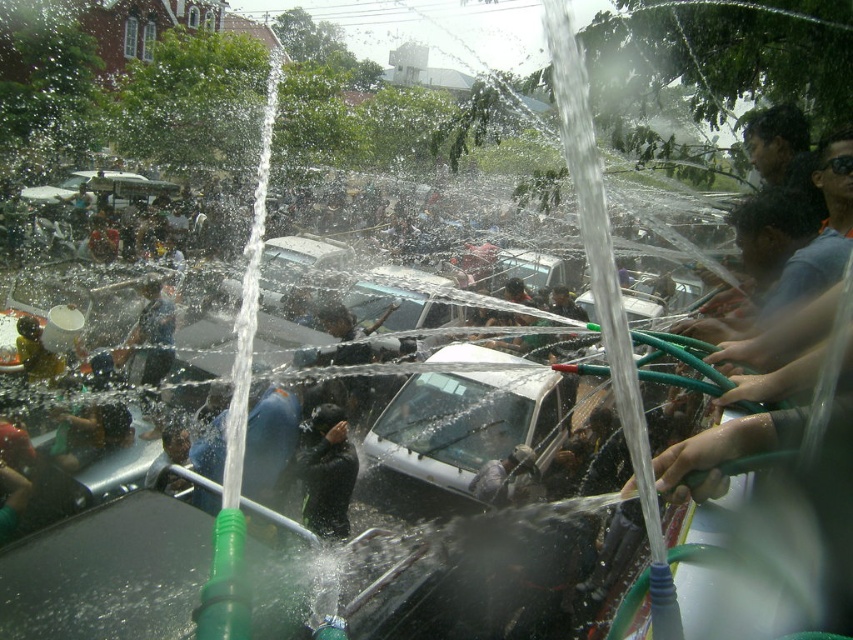
Question: Is black matte clothing at center in front of dark blue fabric shirt at center?

Choices:
 (A) yes
 (B) no

Answer: (A)

Question: Considering the relative positions of black matte clothing at center and dark blue fabric shirt at center in the image provided, where is black matte clothing at center located with respect to dark blue fabric shirt at center?

Choices:
 (A) left
 (B) right

Answer: (B)

Question: Is white matte car at center bigger than black matte clothing at center?

Choices:
 (A) yes
 (B) no

Answer: (A)

Question: Which point appears farthest from the camera in this image?

Choices:
 (A) (326, 508)
 (B) (146, 380)

Answer: (B)

Question: Which point is farther to the camera?

Choices:
 (A) dark blue fabric shirt at center
 (B) white matte car at center
 (C) black matte clothing at center

Answer: (A)

Question: Which point is closer to the camera taking this photo?

Choices:
 (A) (331, 496)
 (B) (566, 404)

Answer: (A)